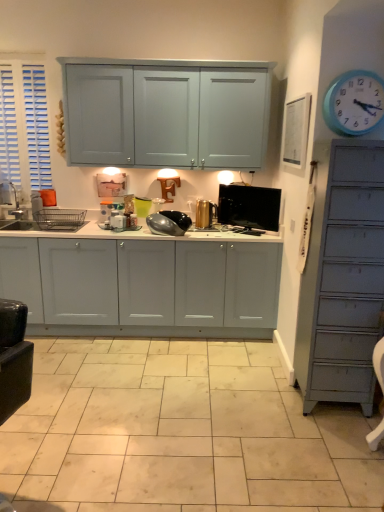
Question: Does white glossy tile at center have a lesser height compared to white glossy cabinets at center?

Choices:
 (A) yes
 (B) no

Answer: (A)

Question: Can you confirm if white glossy tile at center is taller than white glossy cabinets at center?

Choices:
 (A) no
 (B) yes

Answer: (A)

Question: Are white glossy tile at center and white glossy cabinets at center located far from each other?

Choices:
 (A) no
 (B) yes

Answer: (A)

Question: Is white glossy tile at center turned away from white glossy cabinets at center?

Choices:
 (A) yes
 (B) no

Answer: (B)

Question: Is white glossy tile at center placed right next to white glossy cabinets at center?

Choices:
 (A) no
 (B) yes

Answer: (A)

Question: Considering the positions of blue plastic clock at upper right and gold metallic canister at center, which ranks as the 2th appliance in right-to-left order, in the image, is blue plastic clock at upper right taller or shorter than gold metallic canister at center, which ranks as the 2th appliance in right-to-left order,?

Choices:
 (A) tall
 (B) short

Answer: (A)

Question: Is blue plastic clock at upper right inside the boundaries of gold metallic canister at center, which ranks as the 2th appliance in right-to-left order, or outside?

Choices:
 (A) inside
 (B) outside

Answer: (B)

Question: Considering their positions, is blue plastic clock at upper right located in front of or behind gold metallic canister at center, the 2th appliance in the left-to-right sequence?

Choices:
 (A) behind
 (B) front

Answer: (B)

Question: Based on their positions, is blue plastic clock at upper right located to the left or right of gold metallic canister at center, the 2th appliance in the left-to-right sequence?

Choices:
 (A) left
 (B) right

Answer: (B)

Question: Visually, is gold metallic canister at center, which ranks as the 2th appliance in right-to-left order, positioned to the left or to the right of black glossy tv at center, acting as the third appliance starting from the left?

Choices:
 (A) right
 (B) left

Answer: (B)

Question: Which is correct: gold metallic canister at center, the 2th appliance in the left-to-right sequence, is inside black glossy tv at center, acting as the third appliance starting from the left, or outside of it?

Choices:
 (A) outside
 (B) inside

Answer: (A)

Question: In terms of size, does gold metallic canister at center, the 2th appliance in the left-to-right sequence, appear bigger or smaller than black glossy tv at center, the 1th appliance viewed from the right?

Choices:
 (A) small
 (B) big

Answer: (A)

Question: Considering their positions, is gold metallic canister at center, the 2th appliance in the left-to-right sequence, located in front of or behind black glossy tv at center, acting as the third appliance starting from the left?

Choices:
 (A) behind
 (B) front

Answer: (A)

Question: Choose the correct answer: Is black glossy tv at center, acting as the third appliance starting from the left, inside blue plastic clock at upper right or outside it?

Choices:
 (A) inside
 (B) outside

Answer: (B)

Question: Is point (251, 202) closer or farther from the camera than point (350, 118)?

Choices:
 (A) farther
 (B) closer

Answer: (A)